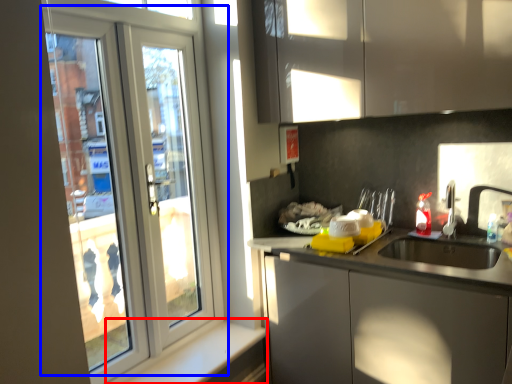
Question: Which object appears farthest to the camera in this image, window sill (highlighted by a red box) or door (highlighted by a blue box)?

Choices:
 (A) window sill
 (B) door

Answer: (A)